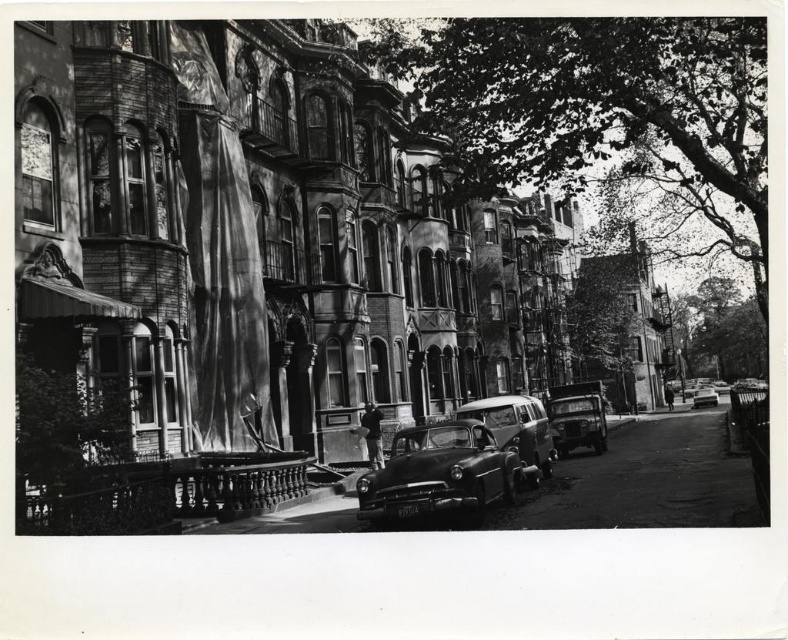
Question: Which object is positioned closest to the shiny silver station wagon at center?

Choices:
 (A) shiny black car at center
 (B) shiny silver sedan at center

Answer: (A)

Question: In this image, where is shiny black car at center located relative to shiny silver sedan at center?

Choices:
 (A) right
 (B) left

Answer: (B)

Question: Can you confirm if shiny chrome car at center-right is positioned above shiny silver sedan at center?

Choices:
 (A) no
 (B) yes

Answer: (B)

Question: Which of the following is the farthest from the observer?

Choices:
 (A) (697, 403)
 (B) (521, 403)
 (C) (385, 493)

Answer: (A)

Question: Does shiny chrome car at center-right have a larger size compared to shiny silver sedan at center?

Choices:
 (A) no
 (B) yes

Answer: (A)

Question: Considering the real-world distances, which object is closest to the shiny black car at center?

Choices:
 (A) shiny chrome car at center-right
 (B) shiny silver station wagon at center
 (C) shiny silver sedan at center

Answer: (B)